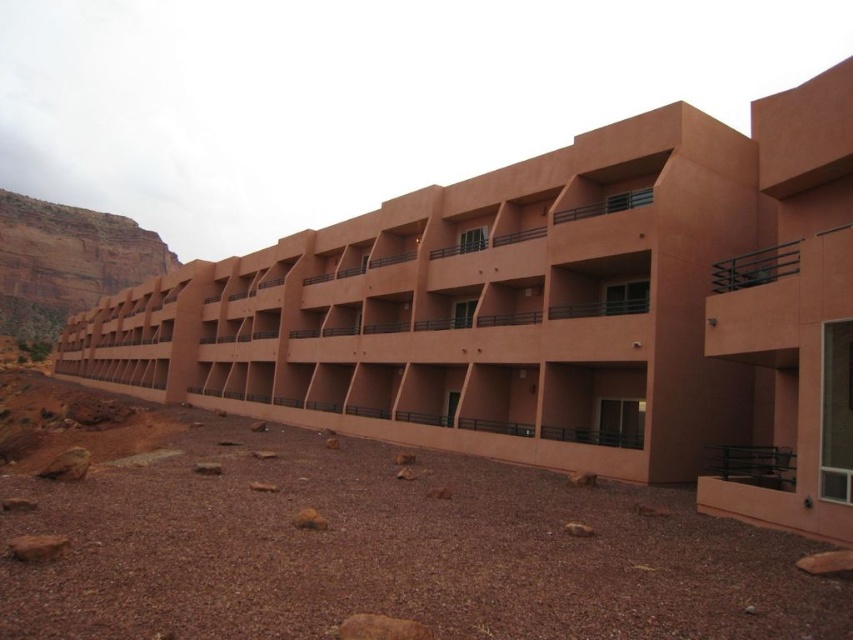
Looking at this image, is matte orange building at center positioned in front of rustic stone cliff at left?

That is True.

Does matte orange building at center have a greater height compared to rustic stone cliff at left?

No.

The image size is (853, 640). What do you see at coordinates (554, 312) in the screenshot? I see `matte orange building at center` at bounding box center [554, 312].

At what (x,y) coordinates should I click in order to perform the action: click on matte orange building at center. Please return your answer as a coordinate pair (x, y). Looking at the image, I should click on (554, 312).